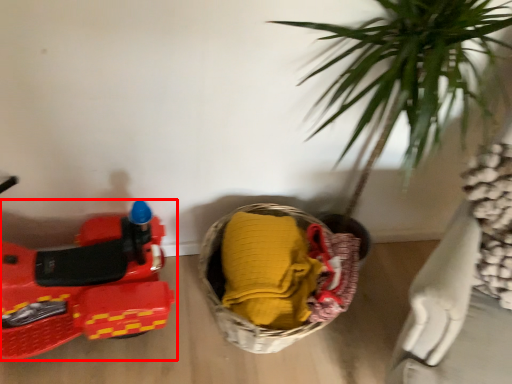
Question: From the image's perspective, where is land vehicle (annotated by the red box) located relative to basket?

Choices:
 (A) above
 (B) below

Answer: (A)